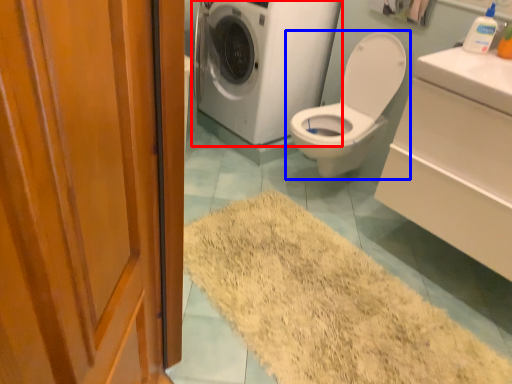
Question: Which of the following is the closest to the observer, washing machine (highlighted by a red box) or toilet (highlighted by a blue box)?

Choices:
 (A) washing machine
 (B) toilet

Answer: (B)